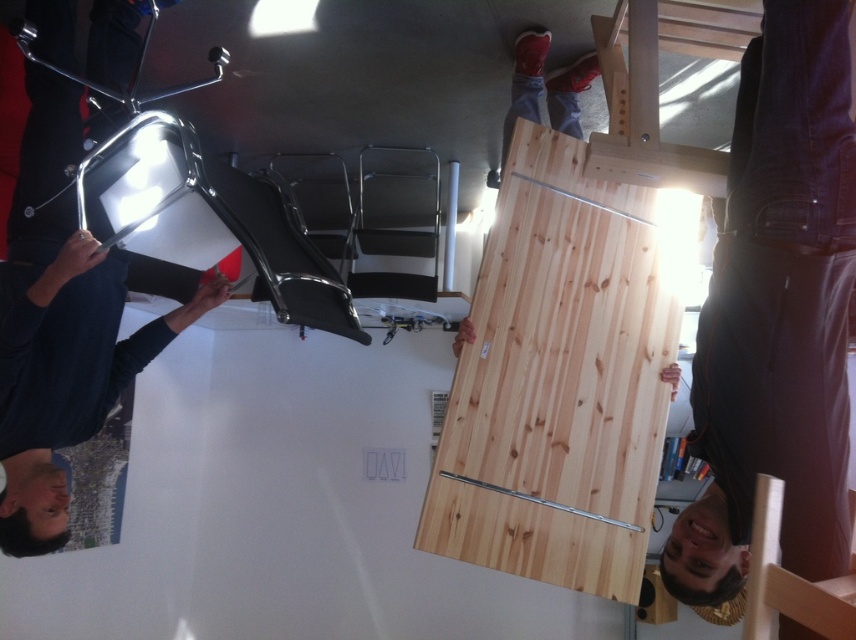
Question: Can you confirm if natural wood bunk bed at upper left is thinner than metallic gray lift at center?

Choices:
 (A) yes
 (B) no

Answer: (B)

Question: Estimate the real-world distances between objects in this image. Which object is farther from the natural wood bunk bed at upper left?

Choices:
 (A) red leather shoes at upper center
 (B) natural wood beam at center
 (C) metallic gray lift at center
 (D) jeans at lower right

Answer: (D)

Question: Which object is positioned farthest from the natural wood beam at center?

Choices:
 (A) natural wood bunk bed at upper left
 (B) metallic gray lift at center
 (C) jeans at lower right

Answer: (C)

Question: Is jeans at lower right closer to camera compared to red leather shoes at upper center?

Choices:
 (A) yes
 (B) no

Answer: (A)

Question: Can you confirm if red leather shoes at upper center is wider than natural wood beam at center?

Choices:
 (A) yes
 (B) no

Answer: (A)

Question: Which point is closer to the camera?

Choices:
 (A) (474, 433)
 (B) (405, 170)

Answer: (A)